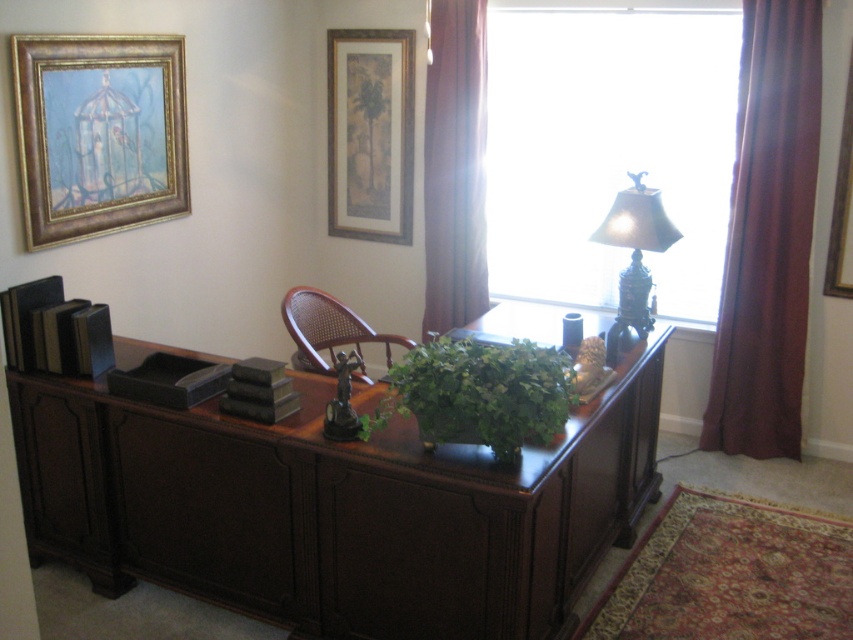
Is brown fabric curtain at right positioned behind metallic gold lamp at upper right?

Yes, it is.

Between brown fabric curtain at right and metallic gold lamp at upper right, which one has less height?

Standing shorter between the two is metallic gold lamp at upper right.

Is point (744, 112) farther from camera compared to point (671, 241)?

Yes, it is.

Identify the location of brown fabric curtain at right. (767, 236).

Which is above, brown fabric curtain at right or matte gold picture frame at upper center?

matte gold picture frame at upper center is higher up.

Does brown fabric curtain at right have a greater height compared to matte gold picture frame at upper center?

Yes, brown fabric curtain at right is taller than matte gold picture frame at upper center.

At what (x,y) coordinates should I click in order to perform the action: click on brown fabric curtain at right. Please return your answer as a coordinate pair (x, y). Looking at the image, I should click on (767, 236).

Who is higher up, brown fabric curtain at right or dark wood drawer at center?

brown fabric curtain at right is above.

Does brown fabric curtain at right lie in front of dark wood drawer at center?

No, it is behind dark wood drawer at center.

This screenshot has width=853, height=640. Find the location of `brown fabric curtain at right`. brown fabric curtain at right is located at coordinates [767, 236].